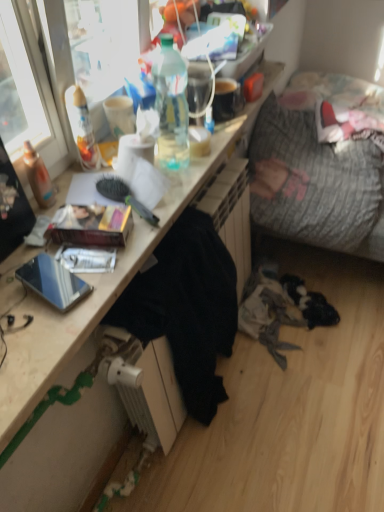
You are a GUI agent. You are given a task and a screenshot of the screen. Output one action in this format:
    pyautogui.click(x=<x>, y=<y>)
    Task: Click on the free spot to the right of black fabric at lower center
    The image size is (384, 512).
    Given the screenshot: What is the action you would take?
    pyautogui.click(x=292, y=413)